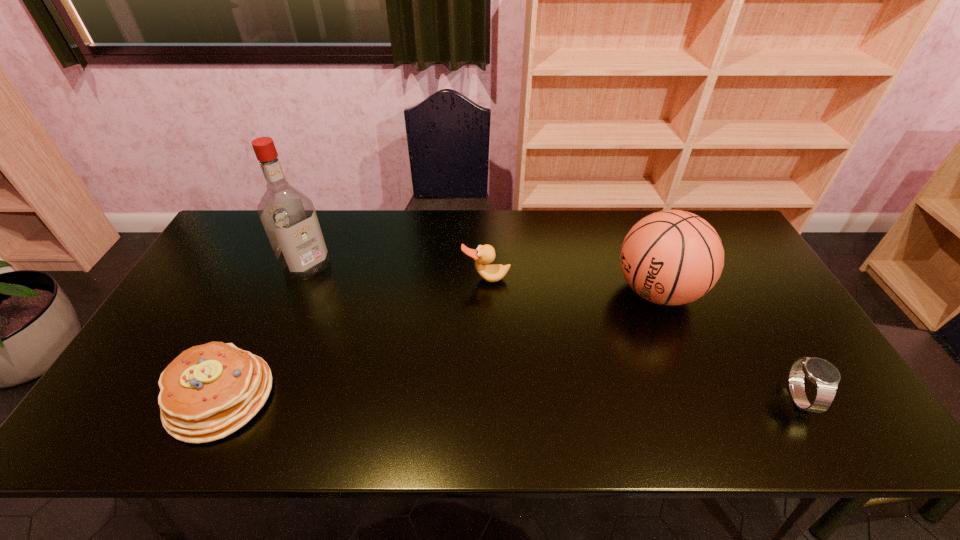
This screenshot has height=540, width=960. I want to click on vacant space located on the beak of the third object from left to right, so click(491, 357).

The width and height of the screenshot is (960, 540). I want to click on vacant area situated 0.090m on the surface of the second tallest object near the brand logo, so click(600, 320).

The width and height of the screenshot is (960, 540). I want to click on vacant space located on the surface of the second tallest object near the brand logo, so click(600, 320).

What are the coordinates of `vacant space located on the surface of the second tallest object near the brand logo` in the screenshot? It's located at (560, 341).

The width and height of the screenshot is (960, 540). I want to click on blank space located 0.050m on the front-facing side of the liquor, so click(x=328, y=285).

The width and height of the screenshot is (960, 540). I want to click on free space located 0.110m on the front-facing side of the liquor, so click(x=340, y=294).

Locate an element on the screen. The image size is (960, 540). vacant space situated 0.350m on the front-facing side of the liquor is located at coordinates (392, 339).

Where is `object located at the far edge`? Image resolution: width=960 pixels, height=540 pixels. object located at the far edge is located at coordinates (288, 216).

The width and height of the screenshot is (960, 540). In order to click on pancake present at the near edge in this screenshot , I will do `click(209, 391)`.

You are a GUI agent. You are given a task and a screenshot of the screen. Output one action in this format:
    pyautogui.click(x=<x>, y=<y>)
    Task: Click on the watch present at the near edge
    Image resolution: width=960 pixels, height=540 pixels.
    Given the screenshot: What is the action you would take?
    pyautogui.click(x=825, y=376)